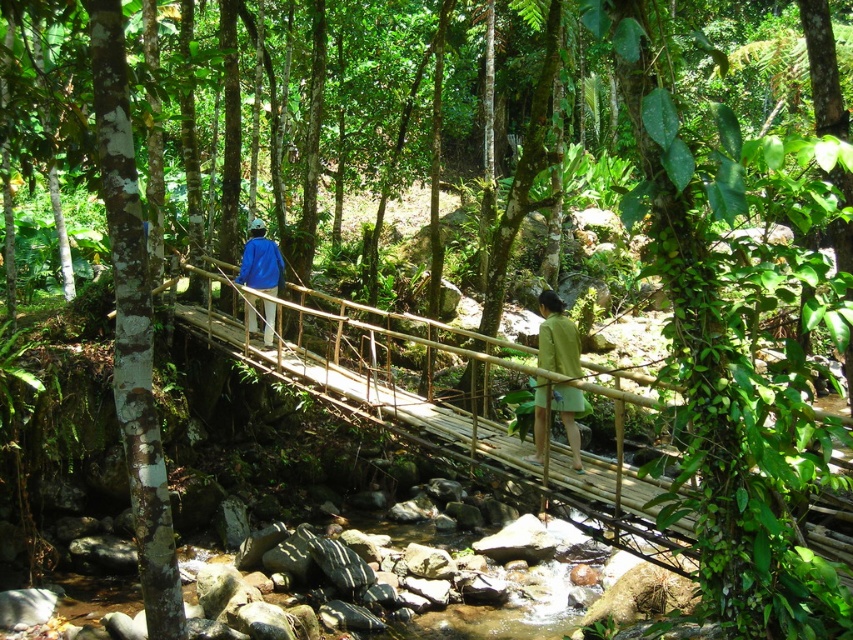
Question: Which of the following is the farthest from the observer?

Choices:
 (A) green matte skirt at center
 (B) blue fabric jacket at center

Answer: (B)

Question: Which point is farther from the camera taking this photo?

Choices:
 (A) (543, 442)
 (B) (267, 301)

Answer: (B)

Question: Can you confirm if green matte skirt at center is smaller than blue fabric jacket at center?

Choices:
 (A) yes
 (B) no

Answer: (A)

Question: Is the position of green matte skirt at center more distant than that of blue fabric jacket at center?

Choices:
 (A) yes
 (B) no

Answer: (B)

Question: Can you confirm if green matte skirt at center is thinner than blue fabric jacket at center?

Choices:
 (A) yes
 (B) no

Answer: (A)